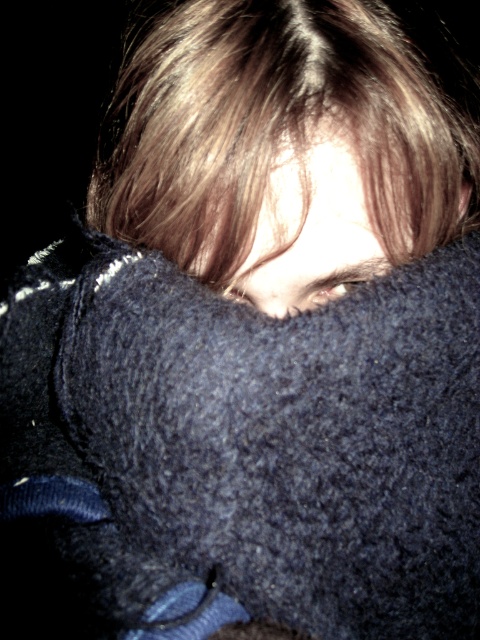
Question: Can you confirm if dark blue fuzzy head at center is wider than smooth brown hair at center?

Choices:
 (A) no
 (B) yes

Answer: (B)

Question: Which point is farther to the camera?

Choices:
 (A) (296, 164)
 (B) (300, 157)

Answer: (A)

Question: Is dark blue fuzzy head at center above smooth brown hair at center?

Choices:
 (A) yes
 (B) no

Answer: (A)

Question: Considering the relative positions of dark blue fuzzy head at center and smooth brown hair at center in the image provided, where is dark blue fuzzy head at center located with respect to smooth brown hair at center?

Choices:
 (A) below
 (B) above

Answer: (B)

Question: Which of the following is the closest to the observer?

Choices:
 (A) dark blue fuzzy head at center
 (B) smooth brown hair at center

Answer: (A)